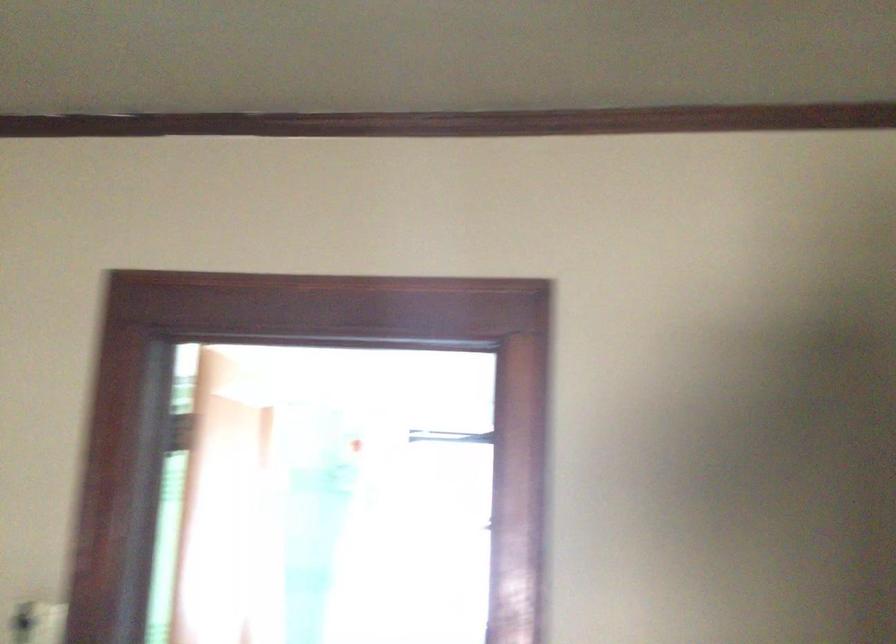
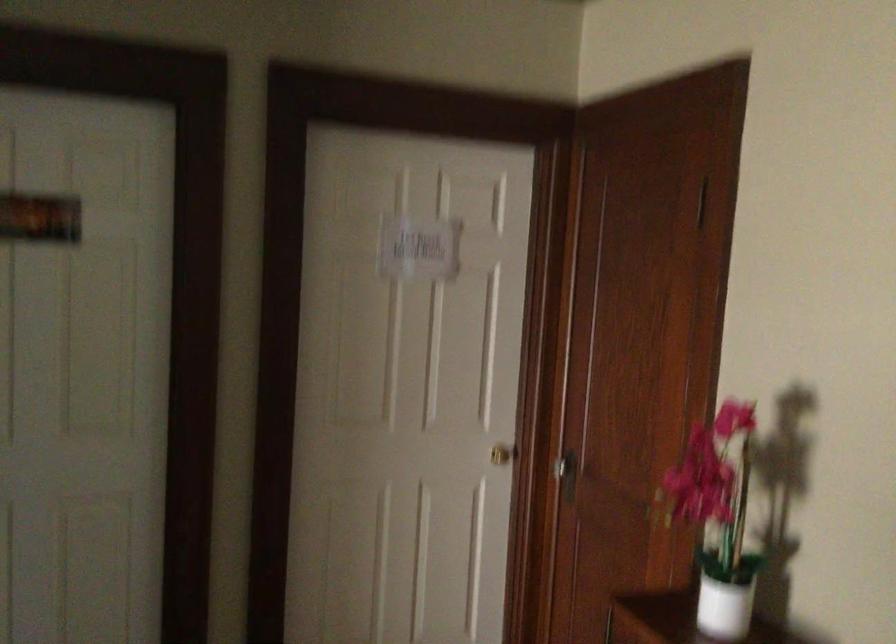
Question: Based on the continuous images, in which direction is the camera rotating? Reply with the corresponding letter.

Choices:
 (A) Left
 (B) Right
 (C) Up
 (D) Down

Answer: (A)